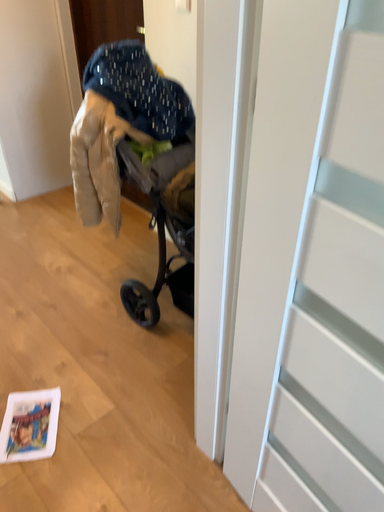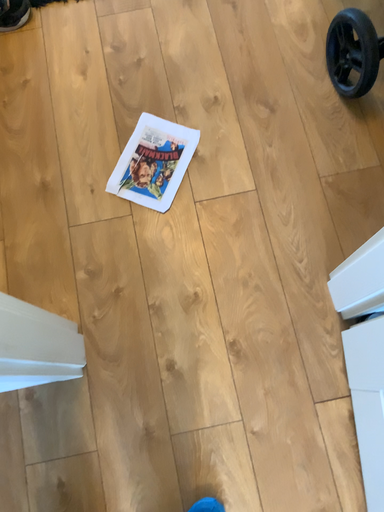
Question: How did the camera likely rotate when shooting the video?

Choices:
 (A) rotated downward
 (B) rotated upward

Answer: (A)